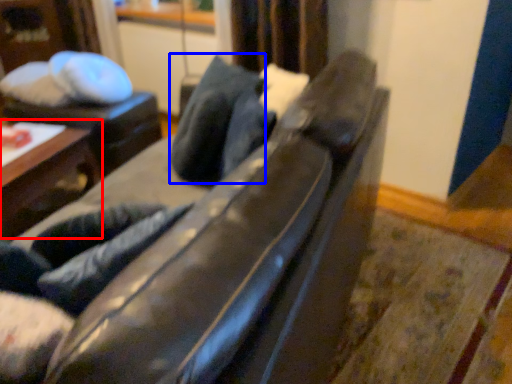
Question: Which object appears farthest to the camera in this image, table (highlighted by a red box) or pillow (highlighted by a blue box)?

Choices:
 (A) table
 (B) pillow

Answer: (A)